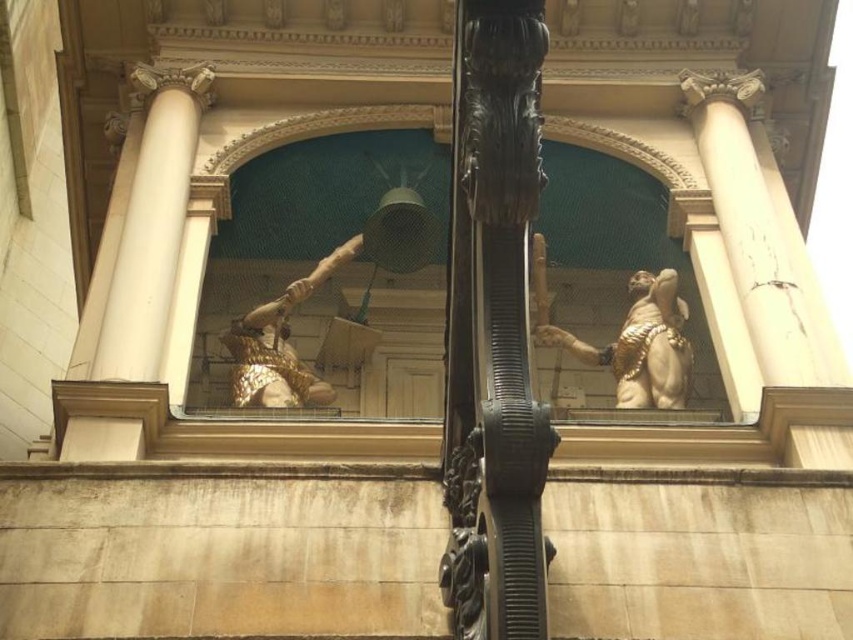
Question: Which object is farther from the camera taking this photo?

Choices:
 (A) gold polished statue at center
 (B) gold textured armor at center

Answer: (A)

Question: Where is black polished wood at center located in relation to gold polished statue at center in the image?

Choices:
 (A) below
 (B) above

Answer: (B)

Question: Considering the relative positions of black polished wood at center and gold polished statue at center in the image provided, where is black polished wood at center located with respect to gold polished statue at center?

Choices:
 (A) right
 (B) left

Answer: (B)

Question: From the image, what is the correct spatial relationship of gold polished statue at center in relation to gold textured armor at center?

Choices:
 (A) left
 (B) right

Answer: (B)

Question: Which of these objects is positioned closest to the gold polished statue at center?

Choices:
 (A) black polished wood at center
 (B) gold textured armor at center

Answer: (B)

Question: Considering the real-world distances, which object is closest to the white marble column at left?

Choices:
 (A) gold polished statue at center
 (B) gold textured armor at center
 (C) black polished wood at center

Answer: (B)